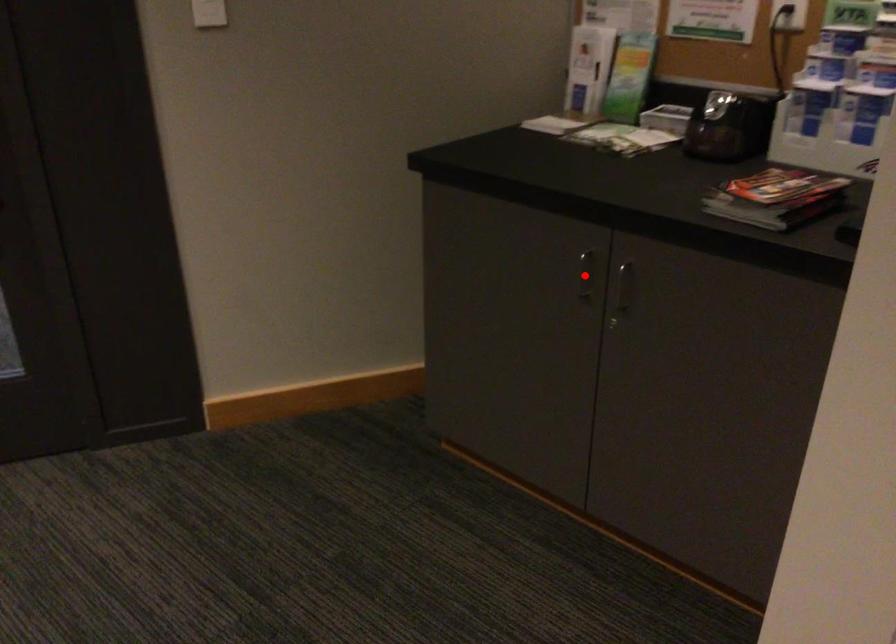
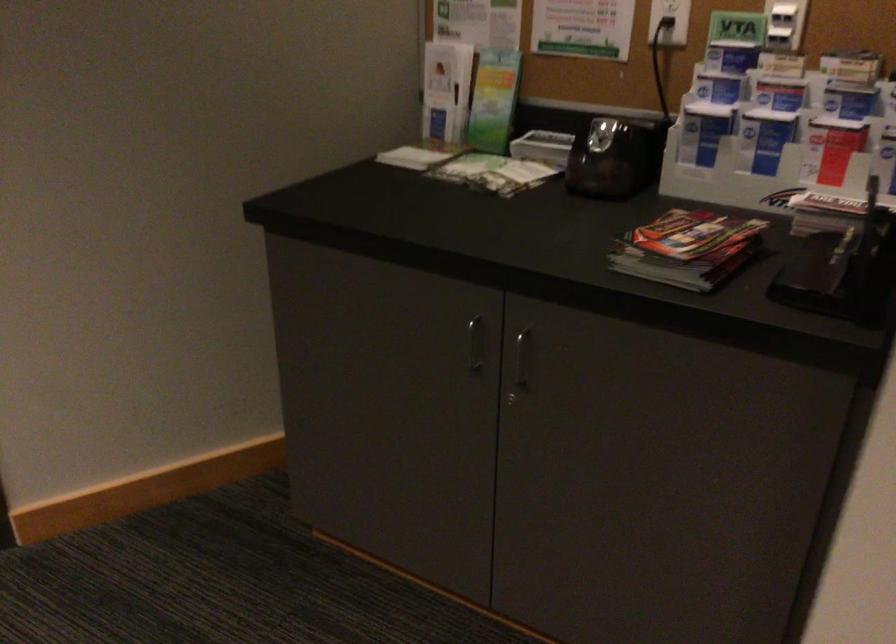
The point at the highlighted location is marked in the first image. Where is the corresponding point in the second image?

(475, 343)